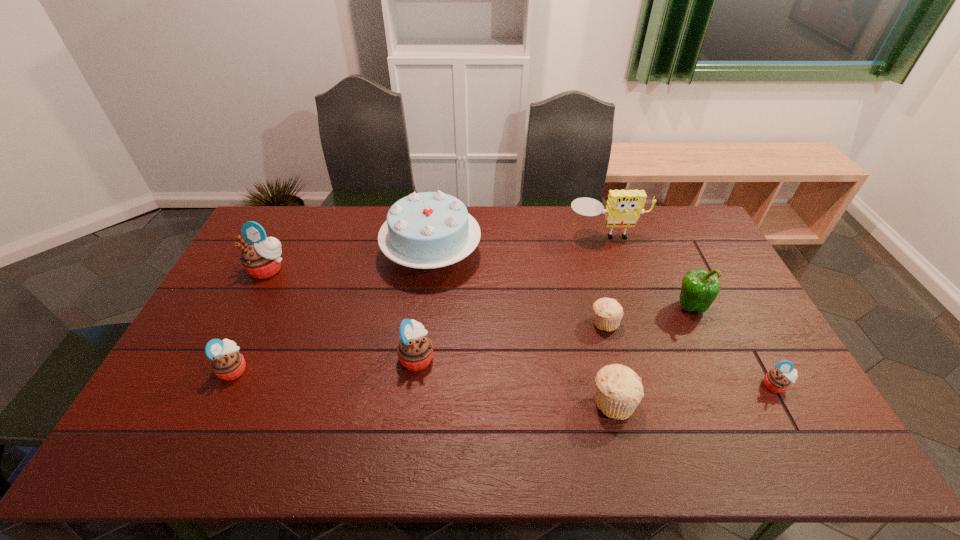
Image resolution: width=960 pixels, height=540 pixels. Find the location of `vacant region that satisfies the following two spatial constraints: 1. on the front-facing side of the yellow sponge; 2. on the front-facing side of the third pink muffin from left to right`. vacant region that satisfies the following two spatial constraints: 1. on the front-facing side of the yellow sponge; 2. on the front-facing side of the third pink muffin from left to right is located at coordinates (645, 357).

The image size is (960, 540). Identify the location of free space that satisfies the following two spatial constraints: 1. on the front-facing side of the third pink muffin from left to right; 2. on the left side of the bigger beige muffin. (412, 402).

This screenshot has height=540, width=960. In order to click on vacant space that satisfies the following two spatial constraints: 1. on the front-facing side of the smaller beige muffin; 2. on the left side of the biggest pink muffin in this screenshot , I will do `click(242, 322)`.

Locate an element on the screen. free region that satisfies the following two spatial constraints: 1. on the front-facing side of the bigger beige muffin; 2. on the right side of the fifth shortest object is located at coordinates (412, 402).